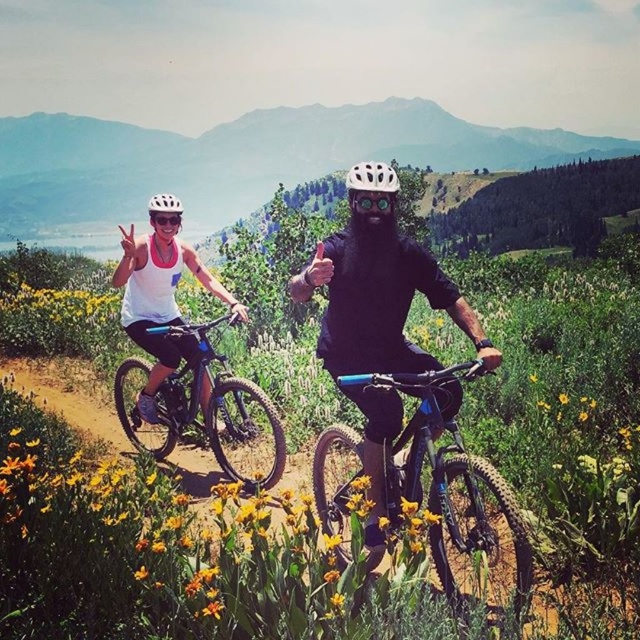
Is matte black bike at left thinner than white matte bicycle helmet at upper center?

Indeed, matte black bike at left has a lesser width compared to white matte bicycle helmet at upper center.

Which is above, matte black bike at left or white matte bicycle helmet at upper center?

white matte bicycle helmet at upper center is above.

Locate an element on the screen. This screenshot has width=640, height=640. matte black bike at left is located at coordinates (160, 298).

Between matte black bicycle at center and white matte bicycle helmet at center, which one is positioned higher?

white matte bicycle helmet at center

Which of these two, matte black bicycle at center or white matte bicycle helmet at center, stands taller?

Standing taller between the two is white matte bicycle helmet at center.

Which is behind, point (188, 365) or point (380, 161)?

Positioned behind is point (380, 161).

Locate an element on the screen. matte black bicycle at center is located at coordinates (198, 403).

Which is behind, point (332, 269) or point (161, 200)?

Point (161, 200)

Who is more forward, (340, 298) or (164, 204)?

Point (340, 298) is in front.

Who is more forward, (392, 419) or (157, 209)?

Point (392, 419) is more forward.

Identify the location of black matte helmet at center. (380, 301).